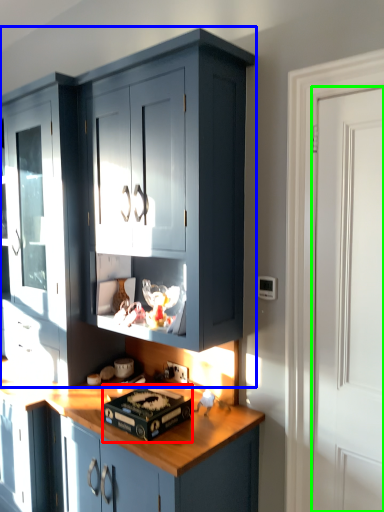
Question: Which is nearer to the appliance (highlighted by a red box)? cabinetry (highlighted by a blue box) or door (highlighted by a green box).

Choices:
 (A) cabinetry
 (B) door

Answer: (A)